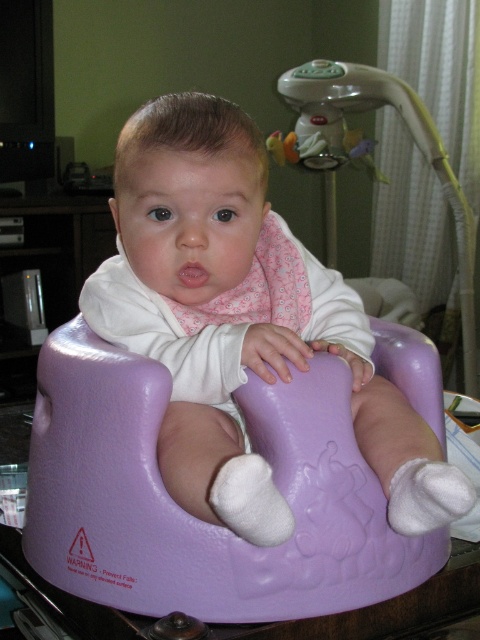
Question: Is matte purple bouncer at center to the left of purple glossy baby seat at center from the viewer's perspective?

Choices:
 (A) yes
 (B) no

Answer: (B)

Question: Is purple glossy baby seat at center in front of plastic baby swing at upper center?

Choices:
 (A) no
 (B) yes

Answer: (B)

Question: Can you confirm if purple glossy baby seat at center is thinner than plastic baby swing at upper center?

Choices:
 (A) no
 (B) yes

Answer: (B)

Question: Among these objects, which one is farthest from the camera?

Choices:
 (A) purple glossy baby seat at center
 (B) plastic baby swing at upper center

Answer: (B)

Question: Which point is closer to the camera?

Choices:
 (A) (455, 497)
 (B) (228, 614)
 (C) (309, 83)

Answer: (A)

Question: Which object is the farthest from the matte purple bouncer at center?

Choices:
 (A) plastic baby swing at upper center
 (B) purple glossy baby seat at center

Answer: (A)